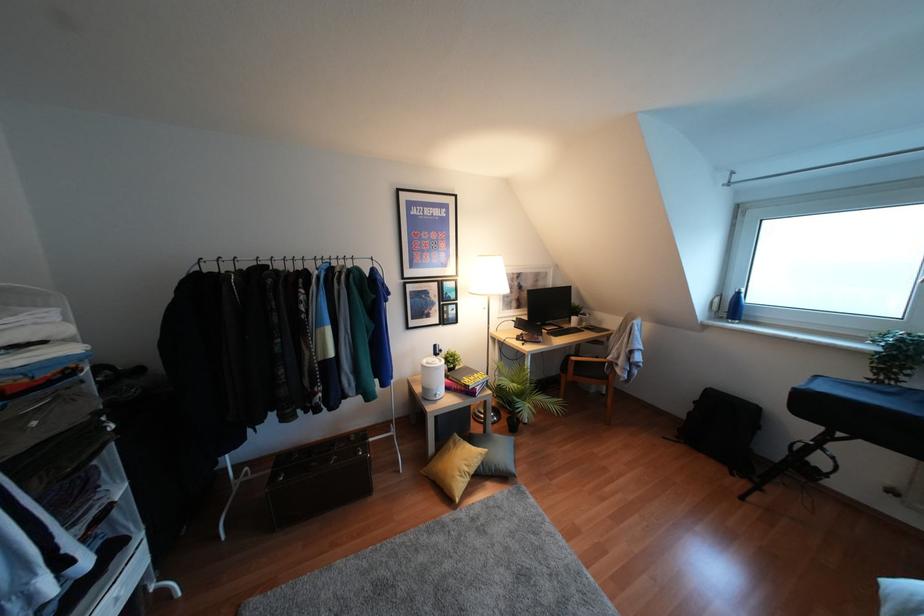
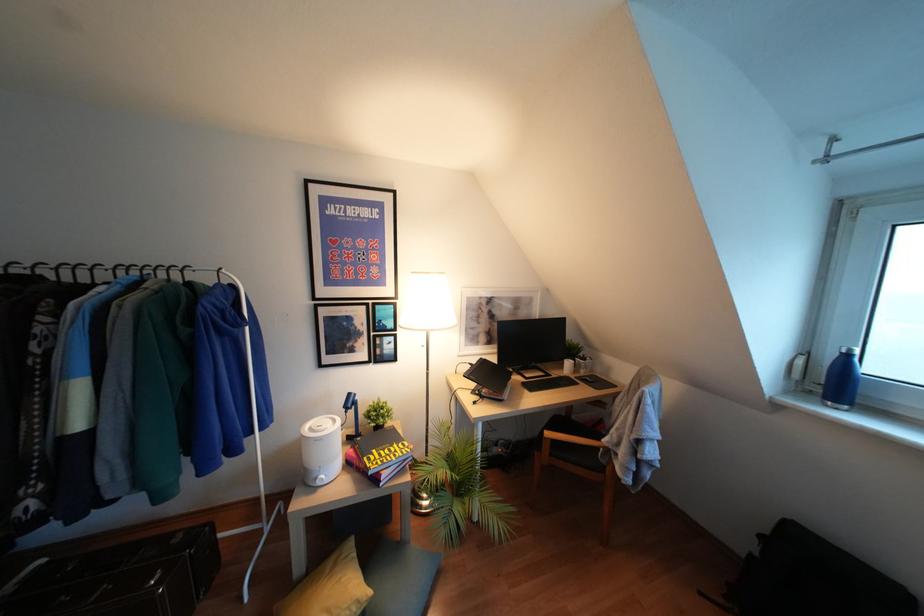
Question: How did the camera likely rotate?

Choices:
 (A) Left
 (B) Right
 (C) Up
 (D) Down

Answer: (A)